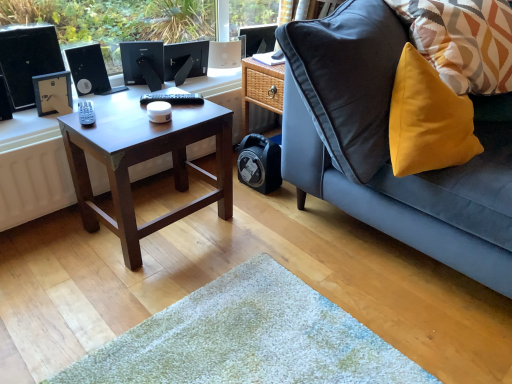
What do you see at coordinates (143, 63) in the screenshot?
I see `satin black monitor at center, which is the 3th computer monitor in right-to-left order` at bounding box center [143, 63].

Identify the location of mustard yellow fabric pillow at right. click(388, 146).

How much space does satin black monitor at upper center, the second computer monitor positioned from the left, occupy vertically?

satin black monitor at upper center, the second computer monitor positioned from the left, is 19.65 centimeters in height.

Measure the distance between satin black monitor at upper center, the second computer monitor positioned from the left, and camera.

A distance of 1.94 meters exists between satin black monitor at upper center, the second computer monitor positioned from the left, and camera.

What is the approximate width of black plastic computer at upper left?

black plastic computer at upper left is 4.64 inches wide.

The width and height of the screenshot is (512, 384). I want to click on yellow fabric pillow at upper right, so click(x=463, y=41).

Image resolution: width=512 pixels, height=384 pixels. There is a yellow fabric pillow at upper right. In order to click on the 3rd computer monitor above it (from the image's perspective) in this screenshot , I will do `click(258, 38)`.

Based on the photo, is yellow fabric pillow at upper right shorter than matte black monitor at upper center, the third computer monitor when ordered from left to right?

In fact, yellow fabric pillow at upper right may be taller than matte black monitor at upper center, the third computer monitor when ordered from left to right.

From the image's perspective, is yellow fabric pillow at upper right located above or below matte black monitor at upper center, the third computer monitor when ordered from left to right?

Based on their image positions, yellow fabric pillow at upper right is located beneath matte black monitor at upper center, the third computer monitor when ordered from left to right.

Considering the sizes of satin black monitor at center, which is the 3th computer monitor in right-to-left order, and black matte desktop computer at left in the image, is satin black monitor at center, which is the 3th computer monitor in right-to-left order, wider or thinner than black matte desktop computer at left?

In the image, satin black monitor at center, which is the 3th computer monitor in right-to-left order, appears to be wider than black matte desktop computer at left.

Considering the sizes of satin black monitor at center, which is the 3th computer monitor in right-to-left order, and black matte desktop computer at left in the image, is satin black monitor at center, which is the 3th computer monitor in right-to-left order, taller or shorter than black matte desktop computer at left?

In the image, satin black monitor at center, which is the 3th computer monitor in right-to-left order, appears to be shorter than black matte desktop computer at left.

How many degrees apart are the facing directions of satin black monitor at center, which is the 3th computer monitor in right-to-left order, and black matte desktop computer at left?

The angle between the facing direction of satin black monitor at center, which is the 3th computer monitor in right-to-left order, and the facing direction of black matte desktop computer at left is 22.8 degrees.

Is satin black monitor at center, which is the 3th computer monitor in right-to-left order, positioned in front of black matte desktop computer at left?

No, satin black monitor at center, which is the 3th computer monitor in right-to-left order, is behind black matte desktop computer at left.

From a real-world perspective, relative to dark brown wood coffee table at center, is satin black monitor at center, which is the 3th computer monitor in right-to-left order, vertically above or below?

In terms of real-world spatial position, satin black monitor at center, which is the 3th computer monitor in right-to-left order, is above dark brown wood coffee table at center.

From the image's perspective, relative to dark brown wood coffee table at center, is satin black monitor at center, which is the 3th computer monitor in right-to-left order, above or below?

satin black monitor at center, which is the 3th computer monitor in right-to-left order, is situated higher than dark brown wood coffee table at center in the image.

Looking at the image, does satin black monitor at center, the first computer monitor from the left, seem bigger or smaller compared to dark brown wood coffee table at center?

In the image, satin black monitor at center, the first computer monitor from the left, appears to be smaller than dark brown wood coffee table at center.

Can you confirm if satin black monitor at center, the first computer monitor from the left, is positioned to the left of dark brown wood coffee table at center?

Correct, you'll find satin black monitor at center, the first computer monitor from the left, to the left of dark brown wood coffee table at center.

Which object is more forward, satin black monitor at center, which is the 3th computer monitor in right-to-left order, or satin black monitor at upper center, which ranks as the second computer monitor in right-to-left order?

satin black monitor at center, which is the 3th computer monitor in right-to-left order, is more forward.

Who is bigger, satin black monitor at center, the first computer monitor from the left, or satin black monitor at upper center, the second computer monitor positioned from the left?

satin black monitor at center, the first computer monitor from the left.

Is satin black monitor at center, the first computer monitor from the left, facing towards satin black monitor at upper center, which ranks as the second computer monitor in right-to-left order?

No, satin black monitor at center, the first computer monitor from the left, is not turned towards satin black monitor at upper center, which ranks as the second computer monitor in right-to-left order.

Who is shorter, satin black monitor at center, which is the 3th computer monitor in right-to-left order, or satin black monitor at upper center, which ranks as the second computer monitor in right-to-left order?

satin black monitor at upper center, which ranks as the second computer monitor in right-to-left order.

Considering the positions of objects black matte desktop computer at left and black plastic computer at upper left in the image provided, who is more to the right, black matte desktop computer at left or black plastic computer at upper left?

Positioned to the right is black plastic computer at upper left.

From the image's perspective, relative to black plastic computer at upper left, is black matte desktop computer at left above or below?

Clearly, from the image's perspective, black matte desktop computer at left is below black plastic computer at upper left.

Would you say black matte desktop computer at left is inside or outside black plastic computer at upper left?

black matte desktop computer at left is outside black plastic computer at upper left.

Is black matte desktop computer at left further to camera compared to black plastic computer at upper left?

No.

What's the angular difference between yellow fabric pillow at upper right and black matte desktop computer at left's facing directions?

There is a 15.6-degree angle between the facing directions of yellow fabric pillow at upper right and black matte desktop computer at left.

Measure the distance between yellow fabric pillow at upper right and black matte desktop computer at left.

The distance of yellow fabric pillow at upper right from black matte desktop computer at left is 1.44 meters.

Considering the positions of points (426, 19) and (45, 28), is point (426, 19) farther from camera compared to point (45, 28)?

No, it is in front of (45, 28).

Looking at this image, is yellow fabric pillow at upper right positioned in front of black matte desktop computer at left?

That is True.

Does dark brown wood coffee table at center turn towards satin black monitor at center, which is the 3th computer monitor in right-to-left order?

No, dark brown wood coffee table at center does not turn towards satin black monitor at center, which is the 3th computer monitor in right-to-left order.

Can you confirm if dark brown wood coffee table at center is smaller than satin black monitor at center, the first computer monitor from the left?

Incorrect, dark brown wood coffee table at center is not smaller in size than satin black monitor at center, the first computer monitor from the left.

Are dark brown wood coffee table at center and satin black monitor at center, the first computer monitor from the left, making contact?

No, dark brown wood coffee table at center is not making contact with satin black monitor at center, the first computer monitor from the left.

Is dark brown wood coffee table at center in front of satin black monitor at center, which is the 3th computer monitor in right-to-left order?

Yes, dark brown wood coffee table at center is closer to the viewer.

Locate an element on the screen. This screenshot has width=512, height=384. the 1st computer monitor to the left of the yellow fabric pillow at upper right, counting from the anchor's position is located at coordinates (258, 38).

Where is `computer monitor that is the 1st one when counting upward from the black matte desktop computer at left (from the image's perspective)`? Image resolution: width=512 pixels, height=384 pixels. computer monitor that is the 1st one when counting upward from the black matte desktop computer at left (from the image's perspective) is located at coordinates (143, 63).

Estimate the real-world distances between objects in this image. Which object is closer to black plastic computer at upper left, mustard yellow fabric pillow at right or satin black monitor at upper center, which ranks as the second computer monitor in right-to-left order?

satin black monitor at upper center, which ranks as the second computer monitor in right-to-left order, is closer to black plastic computer at upper left.

Looking at the image, which one is located further to satin black monitor at upper center, the second computer monitor positioned from the left, satin black monitor at center, which is the 3th computer monitor in right-to-left order, or matte black monitor at upper center, the third computer monitor when ordered from left to right?

The object further to satin black monitor at upper center, the second computer monitor positioned from the left, is matte black monitor at upper center, the third computer monitor when ordered from left to right.

Based on their spatial positions, is black plastic computer at upper left or mustard yellow fabric pillow at right further from matte black monitor at upper center, the third computer monitor when ordered from left to right?

The object further to matte black monitor at upper center, the third computer monitor when ordered from left to right, is mustard yellow fabric pillow at right.

From the image, which object appears to be farther from yellow fabric pillow at upper right, satin black monitor at center, which is the 3th computer monitor in right-to-left order, or matte black monitor at upper center, arranged as the 1th computer monitor when viewed from the right?

satin black monitor at center, which is the 3th computer monitor in right-to-left order, is further to yellow fabric pillow at upper right.

From the image, which object appears to be farther from matte black monitor at upper center, the third computer monitor when ordered from left to right, satin black monitor at center, the first computer monitor from the left, or black matte desktop computer at left?

Based on the image, black matte desktop computer at left appears to be further to matte black monitor at upper center, the third computer monitor when ordered from left to right.

Based on their spatial positions, is yellow fabric pillow at upper right or black plastic computer at upper left closer to black matte desktop computer at left?

black plastic computer at upper left is positioned closer to the anchor black matte desktop computer at left.

From the image, which object appears to be farther from dark brown wood coffee table at center, satin black monitor at upper center, which ranks as the second computer monitor in right-to-left order, or satin black monitor at center, the first computer monitor from the left?

satin black monitor at upper center, which ranks as the second computer monitor in right-to-left order.

Which object lies nearer to the anchor point yellow fabric pillow at upper right, satin black monitor at upper center, which ranks as the second computer monitor in right-to-left order, or satin black monitor at center, the first computer monitor from the left?

satin black monitor at upper center, which ranks as the second computer monitor in right-to-left order, is closer to yellow fabric pillow at upper right.

Where is `coffee table between satin black monitor at center, the first computer monitor from the left, and mustard yellow fabric pillow at right, in the horizontal direction`? The width and height of the screenshot is (512, 384). coffee table between satin black monitor at center, the first computer monitor from the left, and mustard yellow fabric pillow at right, in the horizontal direction is located at coordinates (146, 160).

Find the location of a particular element. desktop computer located between dark brown wood coffee table at center and satin black monitor at center, the first computer monitor from the left, in the depth direction is located at coordinates (27, 59).

Find the location of `desktop computer between dark brown wood coffee table at center and satin black monitor at upper center, the second computer monitor positioned from the left, along the z-axis`. desktop computer between dark brown wood coffee table at center and satin black monitor at upper center, the second computer monitor positioned from the left, along the z-axis is located at coordinates (27, 59).

You are a GUI agent. You are given a task and a screenshot of the screen. Output one action in this format:
    pyautogui.click(x=<x>, y=<y>)
    Task: Click on the computer situated between black matte desktop computer at left and yellow fabric pillow at upper right from left to right
    The width and height of the screenshot is (512, 384).
    Given the screenshot: What is the action you would take?
    pyautogui.click(x=90, y=71)